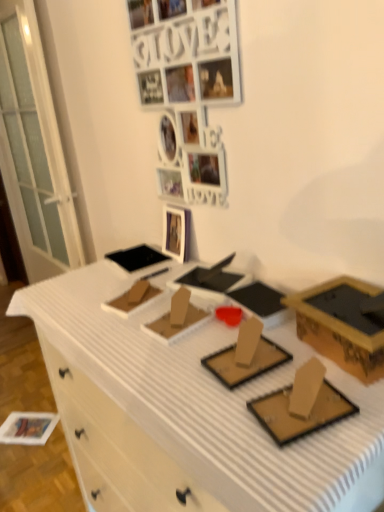
Question: Is white matte drawer at lower left bigger than gold cardboard box at right?

Choices:
 (A) yes
 (B) no

Answer: (A)

Question: Is white matte drawer at lower left positioned beyond the bounds of gold cardboard box at right?

Choices:
 (A) yes
 (B) no

Answer: (A)

Question: Can you confirm if white matte drawer at lower left is positioned to the right of gold cardboard box at right?

Choices:
 (A) yes
 (B) no

Answer: (B)

Question: Does white matte drawer at lower left have a greater height compared to gold cardboard box at right?

Choices:
 (A) no
 (B) yes

Answer: (A)

Question: From a real-world perspective, is white matte drawer at lower left physically below gold cardboard box at right?

Choices:
 (A) yes
 (B) no

Answer: (A)

Question: Considering the positions of white matte drawer at lower left and white cardboard desk at center in the image, is white matte drawer at lower left wider or thinner than white cardboard desk at center?

Choices:
 (A) thin
 (B) wide

Answer: (B)

Question: Considering the positions of point (200, 509) and point (148, 435), is point (200, 509) closer or farther from the camera than point (148, 435)?

Choices:
 (A) closer
 (B) farther

Answer: (A)

Question: From the image's perspective, is white matte drawer at lower left above or below white cardboard desk at center?

Choices:
 (A) above
 (B) below

Answer: (B)

Question: Is white matte drawer at lower left bigger or smaller than white cardboard desk at center?

Choices:
 (A) big
 (B) small

Answer: (B)

Question: Considering the positions of point (x=177, y=249) and point (x=110, y=380), is point (x=177, y=249) closer or farther from the camera than point (x=110, y=380)?

Choices:
 (A) farther
 (B) closer

Answer: (A)

Question: Considering the positions of white glossy picture frame at upper center and white cardboard desk at center in the image, is white glossy picture frame at upper center wider or thinner than white cardboard desk at center?

Choices:
 (A) thin
 (B) wide

Answer: (A)

Question: In the image, is white glossy picture frame at upper center positioned in front of or behind white cardboard desk at center?

Choices:
 (A) front
 (B) behind

Answer: (B)

Question: Is white glossy picture frame at upper center inside or outside of white cardboard desk at center?

Choices:
 (A) inside
 (B) outside

Answer: (B)

Question: Considering the positions of point (160, 56) and point (306, 331), is point (160, 56) closer or farther from the camera than point (306, 331)?

Choices:
 (A) closer
 (B) farther

Answer: (B)

Question: In the image, is white matte photo frame at upper center on the left side or the right side of gold cardboard box at right?

Choices:
 (A) right
 (B) left

Answer: (B)